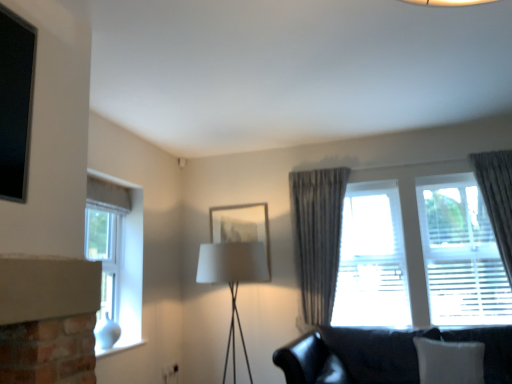
Describe the element at coordinates (317, 237) in the screenshot. I see `textured gray curtain at center, which is the second curtain in right-to-left order` at that location.

Where is `matte glass picture frame at center`? matte glass picture frame at center is located at coordinates (241, 226).

Between translucent fabric curtain at right, the 1th window in the right-to-left sequence, and white fabric pillow at lower right, which one has less height?

white fabric pillow at lower right is shorter.

How much distance is there between translucent fabric curtain at right, which is the second window in left-to-right order, and white fabric pillow at lower right?

The distance of translucent fabric curtain at right, which is the second window in left-to-right order, from white fabric pillow at lower right is 1.10 meters.

Which is more to the left, translucent fabric curtain at right, the 1th window in the right-to-left sequence, or white fabric pillow at lower right?

white fabric pillow at lower right is more to the left.

From the image's perspective, is translucent fabric curtain at right, which is the second window in left-to-right order, located above or below white fabric pillow at lower right?

translucent fabric curtain at right, which is the second window in left-to-right order, is situated higher than white fabric pillow at lower right in the image.

Is black leather couch at lower right beside translucent fabric curtain at right, the 1th window in the right-to-left sequence?

No, black leather couch at lower right is not making contact with translucent fabric curtain at right, the 1th window in the right-to-left sequence.

Does black leather couch at lower right appear on the left side of translucent fabric curtain at right, which is the second window in left-to-right order?

Correct, you'll find black leather couch at lower right to the left of translucent fabric curtain at right, which is the second window in left-to-right order.

From a real-world perspective, who is located higher, black leather couch at lower right or translucent fabric curtain at right, which is the second window in left-to-right order?

translucent fabric curtain at right, which is the second window in left-to-right order.

Is translucent fabric curtain at right, the 1th window in the right-to-left sequence, in contact with black leather couch at lower right?

translucent fabric curtain at right, the 1th window in the right-to-left sequence, and black leather couch at lower right are clearly separated.

From the picture: Is translucent fabric curtain at right, which is the second window in left-to-right order, outside of black leather couch at lower right?

Indeed, translucent fabric curtain at right, which is the second window in left-to-right order, is completely outside black leather couch at lower right.

Is translucent fabric curtain at right, the 1th window in the right-to-left sequence, at the left side of black leather couch at lower right?

No, translucent fabric curtain at right, the 1th window in the right-to-left sequence, is not to the left of black leather couch at lower right.

From a real-world perspective, who is located lower, translucent fabric curtain at right, the 1th window in the right-to-left sequence, or black leather couch at lower right?

In real-world perspective, black leather couch at lower right is lower.

Are matte glass picture frame at center and white glass window at left, placed as the 2th window when sorted from right to left, making contact?

No, matte glass picture frame at center is not touching white glass window at left, placed as the 2th window when sorted from right to left.

Does matte glass picture frame at center contain white glass window at left, the 1th window in the left-to-right sequence?

Actually, white glass window at left, the 1th window in the left-to-right sequence, is outside matte glass picture frame at center.

Which of these two, matte glass picture frame at center or white glass window at left, placed as the 2th window when sorted from right to left, is bigger?

white glass window at left, placed as the 2th window when sorted from right to left, is bigger.

Can you confirm if matte glass picture frame at center is shorter than white glass window at left, placed as the 2th window when sorted from right to left?

Yes, matte glass picture frame at center is shorter than white glass window at left, placed as the 2th window when sorted from right to left.

From the image's perspective, which is above, translucent fabric curtain at right, the 1th window in the right-to-left sequence, or textured gray curtain at center, which is the second curtain in right-to-left order?

From the image's view, translucent fabric curtain at right, the 1th window in the right-to-left sequence, is above.

Is translucent fabric curtain at right, the 1th window in the right-to-left sequence, at the left side of textured gray curtain at center, which is the second curtain in right-to-left order?

In fact, translucent fabric curtain at right, the 1th window in the right-to-left sequence, is to the right of textured gray curtain at center, which is the second curtain in right-to-left order.

Is translucent fabric curtain at right, the 1th window in the right-to-left sequence, positioned far away from textured gray curtain at center, which is the second curtain in right-to-left order?

No, translucent fabric curtain at right, the 1th window in the right-to-left sequence, is not far from textured gray curtain at center, which is the second curtain in right-to-left order.

From a real-world perspective, is translucent fabric curtain at right, which is the second window in left-to-right order, on top of textured gray curtain at center, which is the 1th curtain in left-to-right order?

Correct, in the physical world, translucent fabric curtain at right, which is the second window in left-to-right order, is higher than textured gray curtain at center, which is the 1th curtain in left-to-right order.

From a real-world perspective, between matte glass picture frame at center and silky gray curtain at right, the second curtain when ordered from left to right, who is vertically higher?

matte glass picture frame at center, from a real-world perspective.

Who is taller, matte glass picture frame at center or silky gray curtain at right, which is the 1th curtain from right to left?

silky gray curtain at right, which is the 1th curtain from right to left.

Consider the image. Is matte glass picture frame at center to the right of silky gray curtain at right, which is the 1th curtain from right to left, from the viewer's perspective?

No, matte glass picture frame at center is not to the right of silky gray curtain at right, which is the 1th curtain from right to left.

Locate an element on the screen. The height and width of the screenshot is (384, 512). curtain above the matte glass picture frame at center (from the image's perspective) is located at coordinates (497, 198).

Where is `table lamp that is on the left side of black leather couch at lower right`? This screenshot has height=384, width=512. table lamp that is on the left side of black leather couch at lower right is located at coordinates (233, 279).

Is black leather couch at lower right bigger than white fabric lampshade at center?

Indeed, black leather couch at lower right has a larger size compared to white fabric lampshade at center.

Considering the positions of objects black leather couch at lower right and white fabric lampshade at center in the image provided, who is more to the left, black leather couch at lower right or white fabric lampshade at center?

Positioned to the left is white fabric lampshade at center.

Which point is more forward, (499,358) or (234,250)?

Point (499,358)

Where is `pillow that is under the translucent fabric curtain at right, the 1th window in the right-to-left sequence (from a real-world perspective)`? The width and height of the screenshot is (512, 384). pillow that is under the translucent fabric curtain at right, the 1th window in the right-to-left sequence (from a real-world perspective) is located at coordinates (449, 361).

Where is `studio couch below the translucent fabric curtain at right, which is the second window in left-to-right order (from the image's perspective)`? studio couch below the translucent fabric curtain at right, which is the second window in left-to-right order (from the image's perspective) is located at coordinates (384, 354).

Based on their spatial positions, is white fabric lampshade at center or black leather couch at lower right closer to white fabric pillow at lower right?

black leather couch at lower right lies closer to white fabric pillow at lower right than the other object.

Estimate the real-world distances between objects in this image. Which object is closer to white fabric lampshade at center, white fabric pillow at lower right or silky gray curtain at right, which is the 1th curtain from right to left?

Among the two, white fabric pillow at lower right is located nearer to white fabric lampshade at center.

Estimate the real-world distances between objects in this image. Which object is closer to black leather couch at lower right, textured gray curtain at center, which is the second curtain in right-to-left order, or white fabric lampshade at center?

Based on the image, textured gray curtain at center, which is the second curtain in right-to-left order, appears to be nearer to black leather couch at lower right.

Estimate the real-world distances between objects in this image. Which object is closer to translucent fabric curtain at right, which is the second window in left-to-right order, matte glass picture frame at center or textured gray curtain at center, which is the 1th curtain in left-to-right order?

textured gray curtain at center, which is the 1th curtain in left-to-right order, is closer to translucent fabric curtain at right, which is the second window in left-to-right order.

Looking at this image, considering their positions, is textured gray curtain at center, which is the second curtain in right-to-left order, positioned closer to translucent fabric curtain at right, which is the second window in left-to-right order, than black leather couch at lower right?

Among the two, textured gray curtain at center, which is the second curtain in right-to-left order, is located nearer to translucent fabric curtain at right, which is the second window in left-to-right order.

Based on their spatial positions, is textured gray curtain at center, which is the 1th curtain in left-to-right order, or matte glass picture frame at center closer to white fabric lampshade at center?

matte glass picture frame at center is positioned closer to the anchor white fabric lampshade at center.

Based on the photo, looking at the image, which one is located further to silky gray curtain at right, which is the 1th curtain from right to left, matte glass picture frame at center or textured gray curtain at center, which is the 1th curtain in left-to-right order?

The object further to silky gray curtain at right, which is the 1th curtain from right to left, is matte glass picture frame at center.

From the image, which object appears to be nearer to translucent fabric curtain at right, the 1th window in the right-to-left sequence, white fabric pillow at lower right or silky gray curtain at right, the second curtain when ordered from left to right?

The object closer to translucent fabric curtain at right, the 1th window in the right-to-left sequence, is silky gray curtain at right, the second curtain when ordered from left to right.

Identify the location of pillow located between black leather couch at lower right and textured gray curtain at center, which is the 1th curtain in left-to-right order, in the depth direction. (449, 361).

Identify the location of curtain between white fabric lampshade at center and white fabric pillow at lower right from left to right. This screenshot has width=512, height=384. (317, 237).

The width and height of the screenshot is (512, 384). Identify the location of pillow between white glass window at left, placed as the 2th window when sorted from right to left, and translucent fabric curtain at right, the 1th window in the right-to-left sequence, from left to right. (449, 361).

You are a GUI agent. You are given a task and a screenshot of the screen. Output one action in this format:
    pyautogui.click(x=<x>, y=<y>)
    Task: Click on the studio couch between white glass window at left, placed as the 2th window when sorted from right to left, and white fabric pillow at lower right
    Image resolution: width=512 pixels, height=384 pixels.
    Given the screenshot: What is the action you would take?
    pyautogui.click(x=384, y=354)